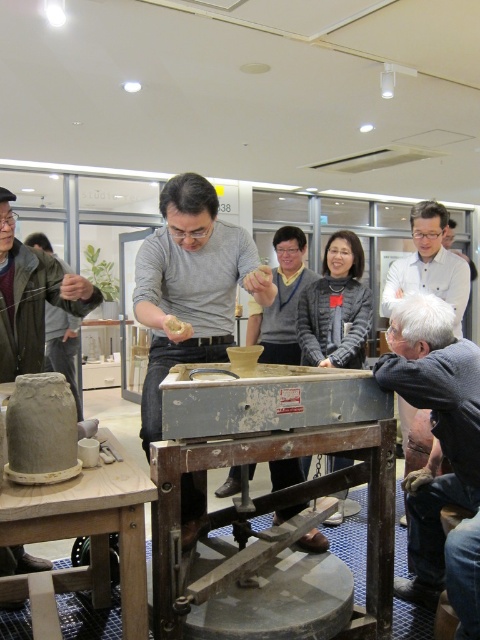
Looking at this image, you are a photographer in the pottery workshop and want to capture a closeup of the central figure. Since the gray matte shirt at center and gray wool sweater at center are both visible, which one should you focus on to ensure the entire garment fits within the frame without cropping?

The gray matte shirt at center is wider than the gray wool sweater at center, so focusing on the gray matte shirt at center would ensure the entire garment fits within the frame without cropping.

You are a photographer setting up a shot of the pottery workshop scene. You want to place a small decorative item exactly at the coordinate point where the gray wool sweater at lower right is located. What are the coordinates you should aim for?

The gray wool sweater at lower right is located at coordinates point (441, 451), so you should aim for those coordinates.